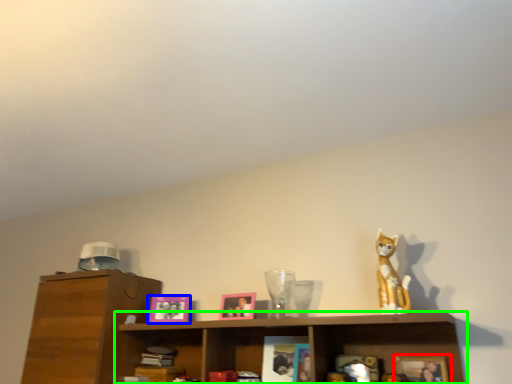
Question: Which is farther away from picture frame (highlighted by a red box)? picture frame (highlighted by a blue box) or shelf (highlighted by a green box)?

Choices:
 (A) picture frame
 (B) shelf

Answer: (A)